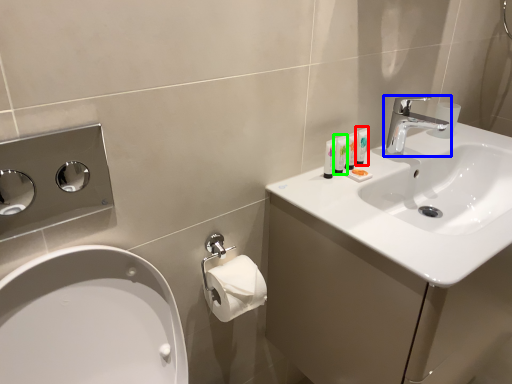
Question: Based on their relative distances, which object is nearer to mouthwash (highlighted by a red box)? Choose from tap (highlighted by a blue box) and mouthwash (highlighted by a green box).

Choices:
 (A) tap
 (B) mouthwash

Answer: (B)